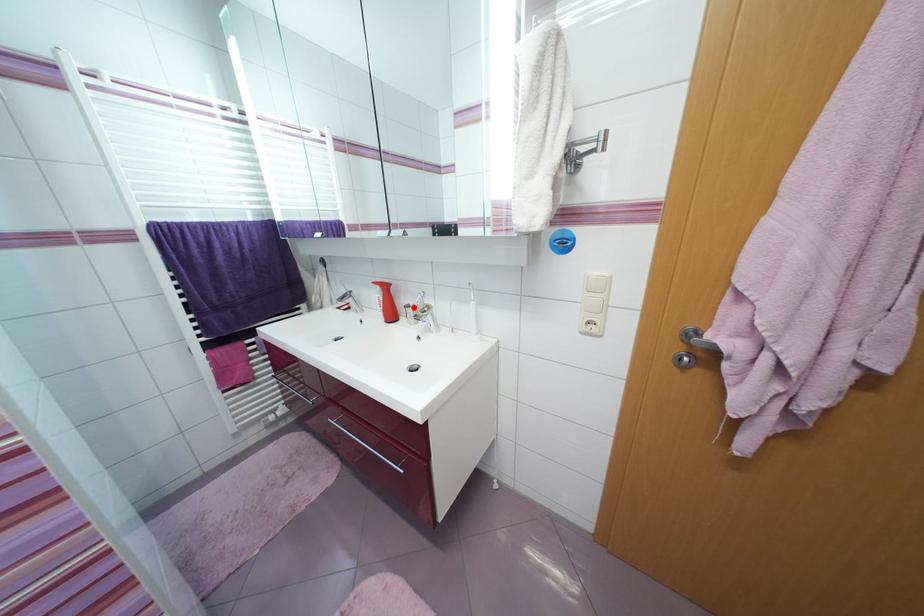
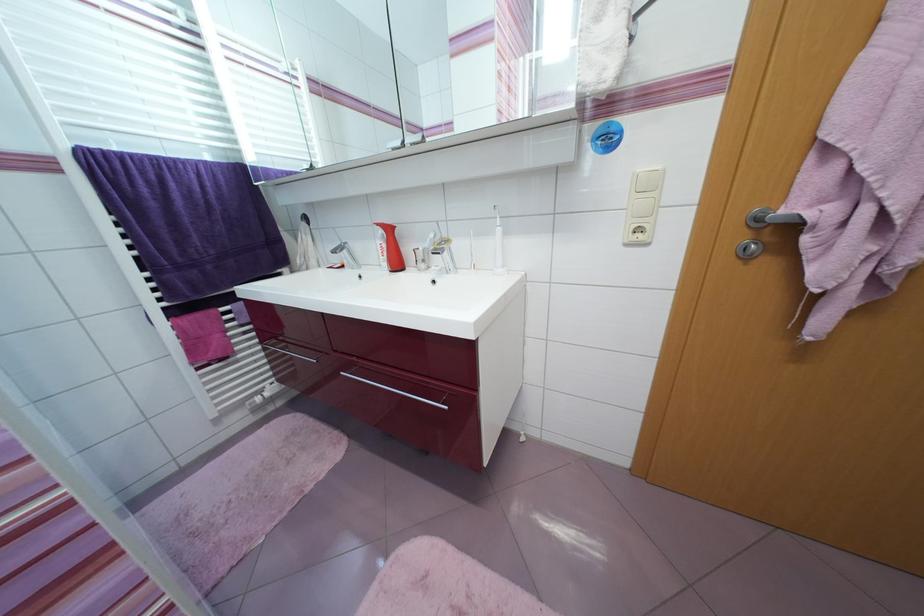
The point at the highlighted location is marked in the first image. Where is the corresponding point in the second image?

(423, 251)